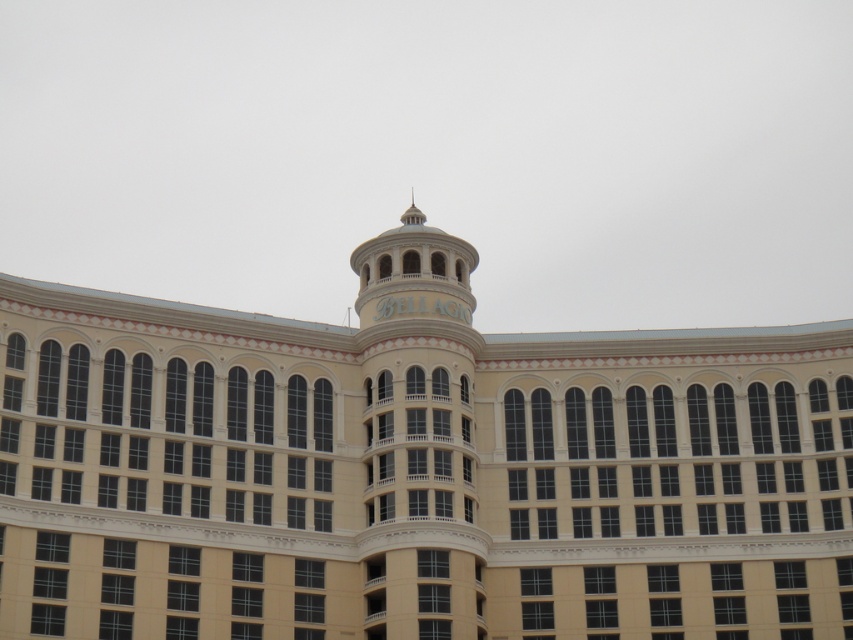
Question: Is beige stone building at center smaller than white marble bell tower at center?

Choices:
 (A) no
 (B) yes

Answer: (B)

Question: Which point is closer to the camera taking this photo?

Choices:
 (A) (218, 417)
 (B) (463, 273)

Answer: (A)

Question: Which point is farther to the camera?

Choices:
 (A) white marble bell tower at center
 (B) beige stone building at center

Answer: (A)

Question: Can you confirm if beige stone building at center is bigger than white marble bell tower at center?

Choices:
 (A) yes
 (B) no

Answer: (B)

Question: Is the position of beige stone building at center more distant than that of white marble bell tower at center?

Choices:
 (A) yes
 (B) no

Answer: (B)